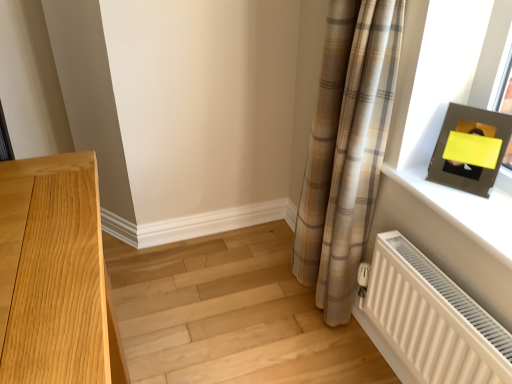
Find the location of a particular element. The height and width of the screenshot is (384, 512). free spot above light wood floor at lower left (from a real-world perspective) is located at coordinates (227, 304).